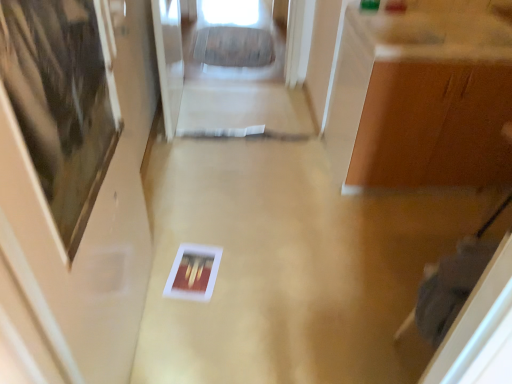
Question: Does point (159, 77) appear closer or farther from the camera than point (487, 79)?

Choices:
 (A) closer
 (B) farther

Answer: (B)

Question: From a real-world perspective, is transparent glass door at upper center positioned above or below matte brown cabinet at upper right?

Choices:
 (A) above
 (B) below

Answer: (B)

Question: Which object is the closest to the matte wood door at left?

Choices:
 (A) matte brown cabinet at upper right
 (B) transparent glass door at upper center

Answer: (B)

Question: Which of these objects is positioned farthest from the matte wood door at left?

Choices:
 (A) transparent glass door at upper center
 (B) matte brown cabinet at upper right

Answer: (B)